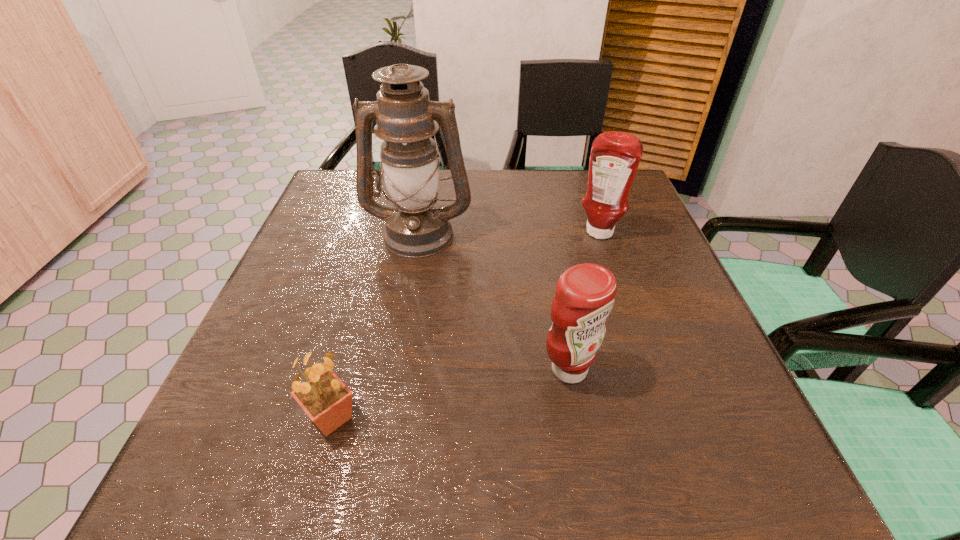
Locate an element on the screen. The image size is (960, 540). free space between the shortest object and the tallest object is located at coordinates (375, 326).

Find the location of a particular element. The width and height of the screenshot is (960, 540). vacant area that lies between the nearest object and the oil lamp is located at coordinates (375, 326).

Where is `empty space that is in between the nearest object and the left condiment`? This screenshot has height=540, width=960. empty space that is in between the nearest object and the left condiment is located at coordinates (x=450, y=394).

At what (x,y) coordinates should I click in order to perform the action: click on blank region between the oil lamp and the right condiment. Please return your answer as a coordinate pair (x, y). Looking at the image, I should click on (509, 233).

You are a GUI agent. You are given a task and a screenshot of the screen. Output one action in this format:
    pyautogui.click(x=<x>, y=<y>)
    Task: Click on the object that ranks as the third closest to the tallest object
    The height and width of the screenshot is (540, 960).
    Given the screenshot: What is the action you would take?
    pyautogui.click(x=327, y=401)

Select which object is the second closest to the shortest object. Please provide its 2D coordinates. Your answer should be formatted as a tuple, i.e. [(x, y)], where the tuple contains the x and y coordinates of a point satisfying the conditions above.

[(416, 226)]

I want to click on vacant region that satisfies the following two spatial constraints: 1. on the back side of the left condiment; 2. on the left side of the rightmost object, so click(544, 234).

The image size is (960, 540). What are the coordinates of `vacant space that satisfies the following two spatial constraints: 1. on the front side of the second shortest object; 2. at the front of the shortest object with flowers visible` in the screenshot? It's located at (578, 417).

This screenshot has width=960, height=540. Identify the location of vacant position in the image that satisfies the following two spatial constraints: 1. on the front side of the farther condiment; 2. at the front of the nearest object with flowers visible. (661, 417).

The height and width of the screenshot is (540, 960). I want to click on vacant area in the image that satisfies the following two spatial constraints: 1. on the front side of the right condiment; 2. at the front of the sunflower with flowers visible, so click(661, 417).